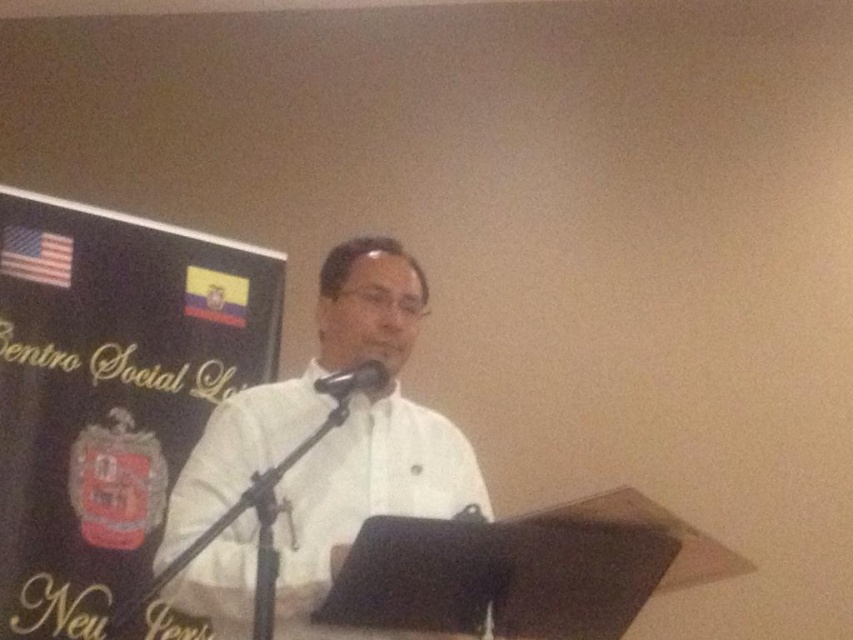
You are a photographer adjusting your camera settings to capture the scene. You notice two points in the image at coordinates point (x=187, y=630) and point (x=242, y=563). Which point is closer to your camera lens?

Point (x=187, y=630) is further to the viewer than point (x=242, y=563), so the point closer to the camera lens is point (x=242, y=563).

You are a photographer at the event and want to capture a closeup of the speaker. Since the white glossy shirt at center and the black matte microphone at center are both in the frame, which object is positioned to the right of the other?

The white glossy shirt at center is to the right of the black matte microphone at center.

You are at a formal event and see the podium with a dark surface and a microphone stand. There is a point marked at coordinates [109,392]. What is located at that point?

The point at coordinates [109,392] is the location of the black fabric at left.